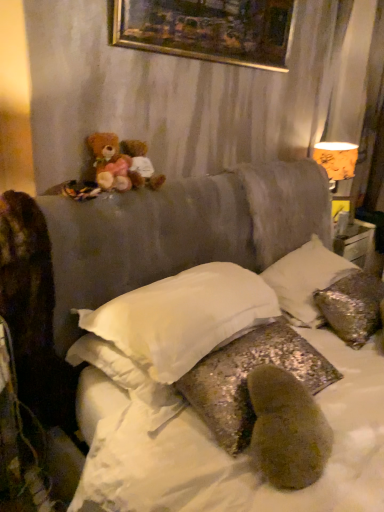
Question: Should I look upward or downward to see orange paper lampshade at upper right?

Choices:
 (A) down
 (B) up

Answer: (B)

Question: Is soft brown teddy bear at upper left, which appears as the second teddy bear when viewed from the right, taller than silver sequined pillow at upper right, which is the 3th pillow from left to right?

Choices:
 (A) no
 (B) yes

Answer: (A)

Question: Can you confirm if soft brown teddy bear at upper left, which appears as the second teddy bear when viewed from the right, is smaller than silver sequined pillow at upper right, acting as the 1th pillow starting from the right?

Choices:
 (A) no
 (B) yes

Answer: (B)

Question: Is silver sequined pillow at upper right, which is the 3th pillow from left to right, a part of soft brown teddy bear at upper left, which appears as the second teddy bear when viewed from the right?

Choices:
 (A) yes
 (B) no

Answer: (B)

Question: Does soft brown teddy bear at upper left, the first teddy bear in the left-to-right sequence, have a lesser width compared to silver sequined pillow at upper right, which is the 3th pillow from left to right?

Choices:
 (A) no
 (B) yes

Answer: (B)

Question: Are soft brown teddy bear at upper left, which appears as the second teddy bear when viewed from the right, and silver sequined pillow at upper right, which is the 3th pillow from left to right, making contact?

Choices:
 (A) no
 (B) yes

Answer: (A)

Question: Considering the relative sizes of soft brown teddy bear at upper left, which appears as the second teddy bear when viewed from the right, and silver sequined pillow at upper right, which is the 3th pillow from left to right, in the image provided, is soft brown teddy bear at upper left, which appears as the second teddy bear when viewed from the right, shorter than silver sequined pillow at upper right, which is the 3th pillow from left to right,?

Choices:
 (A) no
 (B) yes

Answer: (B)

Question: From a real-world perspective, is soft brown teddy bear at upper left, which appears as the second teddy bear when viewed from the right, physically above glittery sequined pillow at center, the 2th pillow from the left?

Choices:
 (A) no
 (B) yes

Answer: (B)

Question: Is soft brown teddy bear at upper left, the first teddy bear in the left-to-right sequence, smaller than glittery sequined pillow at center, positioned as the second pillow in right-to-left order?

Choices:
 (A) yes
 (B) no

Answer: (A)

Question: Is glittery sequined pillow at center, the 2th pillow from the left, at the back of soft brown teddy bear at upper left, which appears as the second teddy bear when viewed from the right?

Choices:
 (A) yes
 (B) no

Answer: (B)

Question: Is soft brown teddy bear at upper left, which appears as the second teddy bear when viewed from the right, wider than glittery sequined pillow at center, the 2th pillow from the left?

Choices:
 (A) yes
 (B) no

Answer: (B)

Question: Can you confirm if soft brown teddy bear at upper left, the first teddy bear in the left-to-right sequence, is positioned to the left of glittery sequined pillow at center, positioned as the second pillow in right-to-left order?

Choices:
 (A) no
 (B) yes

Answer: (B)

Question: Is soft brown teddy bear at upper left, which appears as the second teddy bear when viewed from the right, aimed at glittery sequined pillow at center, positioned as the second pillow in right-to-left order?

Choices:
 (A) no
 (B) yes

Answer: (A)

Question: Does silver sequined pillow at upper right, acting as the 1th pillow starting from the right, have a lesser height compared to orange paper lampshade at upper right?

Choices:
 (A) no
 (B) yes

Answer: (B)